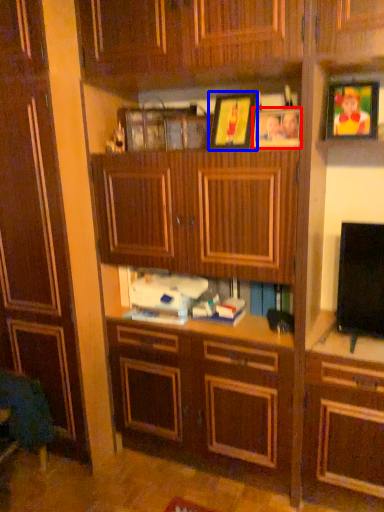
Question: Which object appears closest to the camera in this image, picture frame (highlighted by a red box) or picture frame (highlighted by a blue box)?

Choices:
 (A) picture frame
 (B) picture frame

Answer: (A)